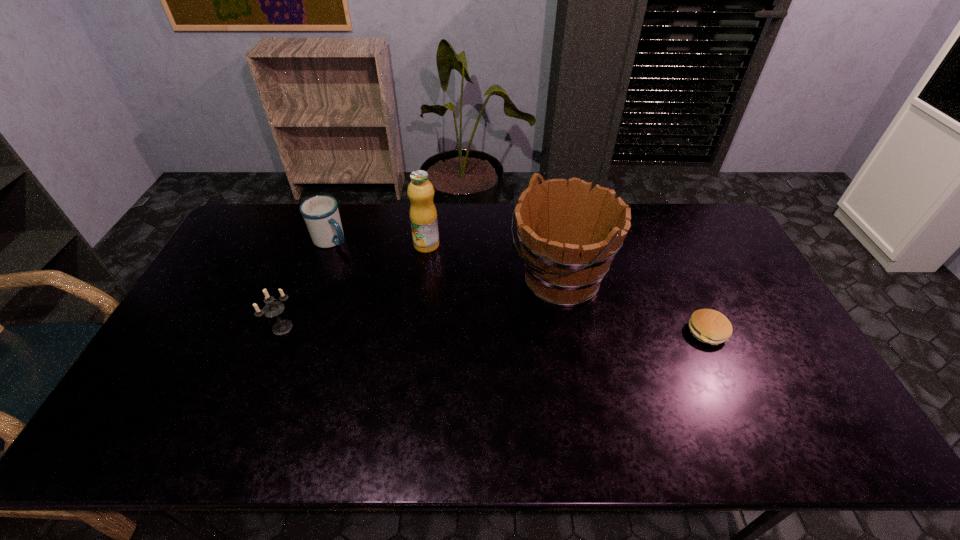
In the image, there is a desktop. At what (x,y) coordinates should I click in order to perform the action: click on vacant space at the near edge. Please return your answer as a coordinate pair (x, y). Looking at the image, I should click on (547, 406).

You are a GUI agent. You are given a task and a screenshot of the screen. Output one action in this format:
    pyautogui.click(x=<x>, y=<y>)
    Task: Click on the free space at the right edge of the desktop
    The height and width of the screenshot is (540, 960).
    Given the screenshot: What is the action you would take?
    pyautogui.click(x=768, y=366)

In the image, there is a desktop. At what (x,y) coordinates should I click in order to perform the action: click on free space at the near left corner. Please return your answer as a coordinate pair (x, y). The height and width of the screenshot is (540, 960). Looking at the image, I should click on (205, 381).

Where is `free space at the far right corner`? The image size is (960, 540). free space at the far right corner is located at coordinates (704, 218).

The image size is (960, 540). What are the coordinates of `free space at the near right corner` in the screenshot? It's located at (811, 385).

Identify the location of free point between the candle holder and the fourth object from left to right. (421, 305).

In order to click on vacant region between the candle holder and the shortest object in this screenshot , I will do `click(494, 329)`.

Locate an element on the screen. free space between the rightmost object and the candle holder is located at coordinates (494, 329).

Locate an element on the screen. vacant space in between the third object from right to left and the mug is located at coordinates coord(379,242).

The width and height of the screenshot is (960, 540). Find the location of `vacant space that's between the mug and the rightmost object`. vacant space that's between the mug and the rightmost object is located at coordinates (519, 286).